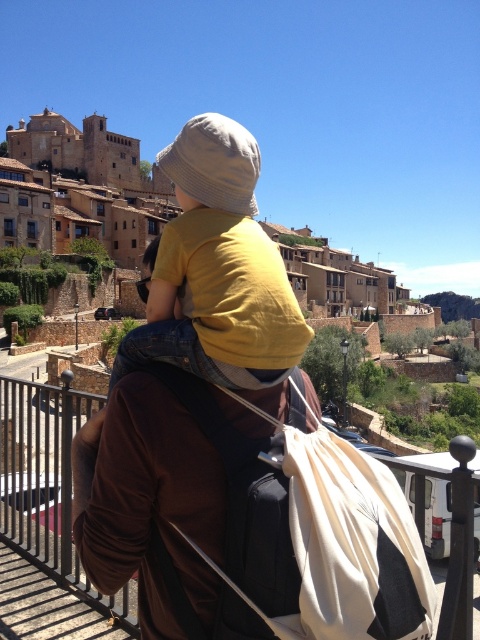
Question: Which object appears closest to the camera in this image?

Choices:
 (A) metallic gray railing at center
 (B) matte yellow shirt at center

Answer: (A)

Question: Is matte yellow shirt at center smaller than metallic gray railing at center?

Choices:
 (A) no
 (B) yes

Answer: (B)

Question: Does matte yellow shirt at center lie in front of metallic gray railing at center?

Choices:
 (A) no
 (B) yes

Answer: (A)

Question: Does matte yellow shirt at center appear on the right side of metallic gray railing at center?

Choices:
 (A) no
 (B) yes

Answer: (B)